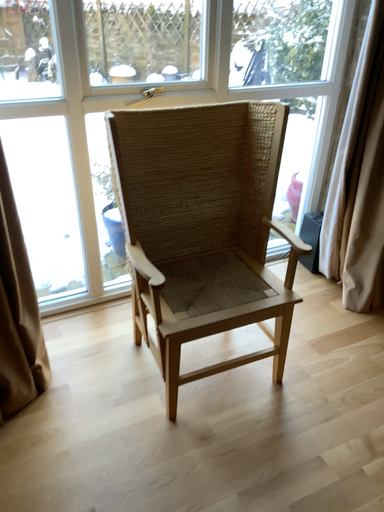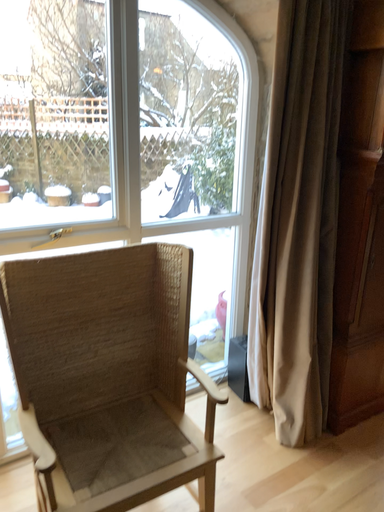
Question: Which way did the camera rotate in the video?

Choices:
 (A) rotated right
 (B) rotated left

Answer: (A)